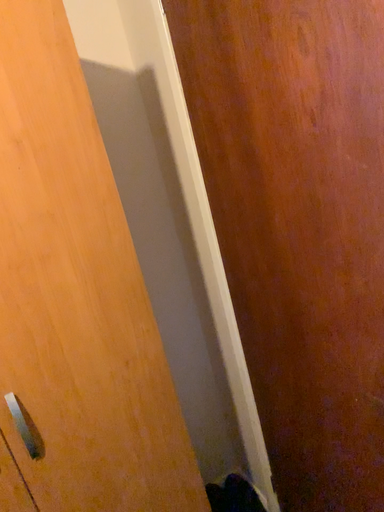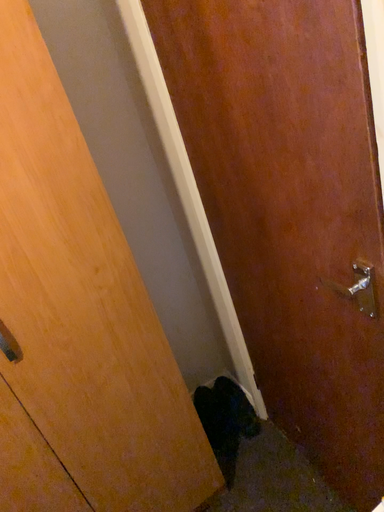
Question: Which way did the camera rotate in the video?

Choices:
 (A) rotated downward
 (B) rotated upward

Answer: (A)